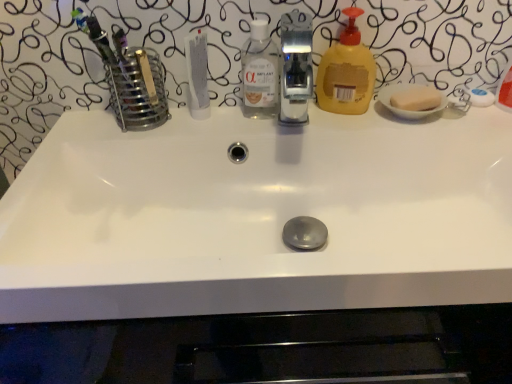
Find the location of a particular element. This screenshot has height=384, width=512. free spot in front of yellow translucent liquid soap at right is located at coordinates (352, 127).